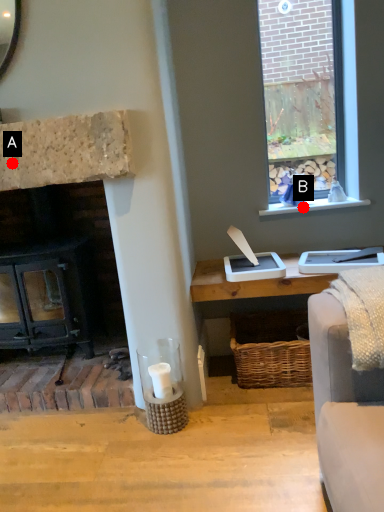
Question: Two points are circled on the image, labeled by A and B beside each circle. Which point is closer to the camera?

Choices:
 (A) A is closer
 (B) B is closer

Answer: (A)